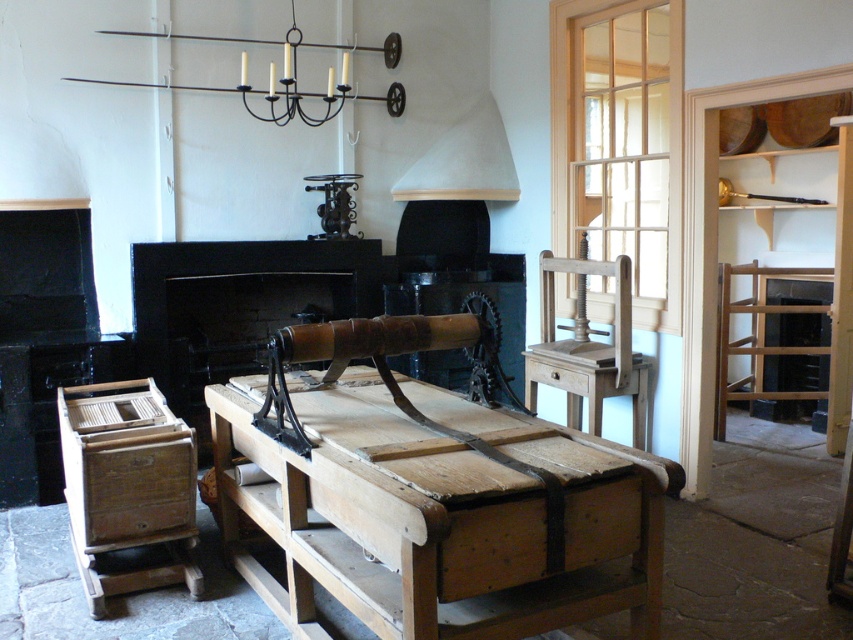
Question: Which of the following is the farthest from the observer?

Choices:
 (A) light brown wood chair at center right
 (B) wooden table at center
 (C) black metal chandelier at upper center

Answer: (C)

Question: Can you confirm if black matte fireplace at center is thinner than black metal chandelier at upper center?

Choices:
 (A) yes
 (B) no

Answer: (A)

Question: Does wooden table at center appear on the left side of light brown wood chair at center right?

Choices:
 (A) no
 (B) yes

Answer: (B)

Question: Which point is closer to the camera taking this photo?

Choices:
 (A) click(73, 77)
 (B) click(578, 305)
 (C) click(328, 316)
 (D) click(277, 588)

Answer: (D)

Question: Among these objects, which one is nearest to the camera?

Choices:
 (A) black metal chandelier at upper center
 (B) black matte fireplace at center
 (C) light brown wood chair at center right
 (D) wooden table at center

Answer: (D)

Question: Is wooden table at center thinner than light brown wood chair at center right?

Choices:
 (A) yes
 (B) no

Answer: (B)